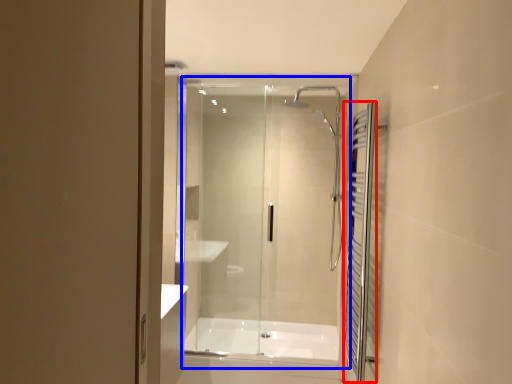
Question: Which object appears closest to the camera in this image, shower curtain (highlighted by a red box) or glass door (highlighted by a blue box)?

Choices:
 (A) shower curtain
 (B) glass door

Answer: (A)